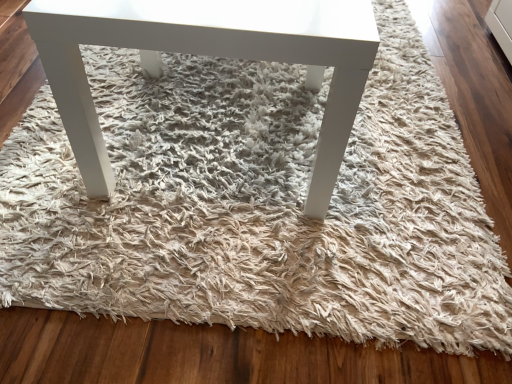
What do you see at coordinates (211, 55) in the screenshot? The image size is (512, 384). I see `white matte table at center` at bounding box center [211, 55].

Find the location of a particular element. Image resolution: width=512 pixels, height=384 pixels. white matte table at center is located at coordinates click(x=211, y=55).

Identify the location of white matte table at center. (211, 55).